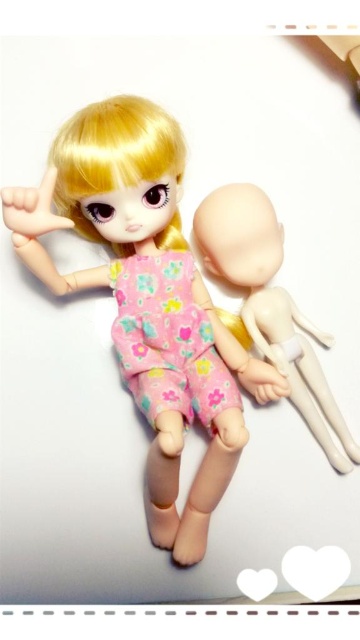
Consider the image. You are a photographer setting up a shoot with two dolls. The scene requires you to focus on the matte pink fabric doll at center without the smooth beige head at center being too prominent. Based on their positions, can you achieve this by adjusting the camera focus to emphasize depth of field?

Yes, since the matte pink fabric doll at center is closer to the viewer than the smooth beige head at center, adjusting the camera focus on the matte pink fabric doll at center while keeping the smooth beige head at center slightly out of focus will help achieve the desired effect.

You are a toy organizer who needs to stack these two dolls vertically. Given that the matte pink fabric doll at center is taller than the smooth beige head at center, which doll should you place at the bottom to ensure stability?

You should place the matte pink fabric doll at center at the bottom since it is taller and provides a wider base for stability.